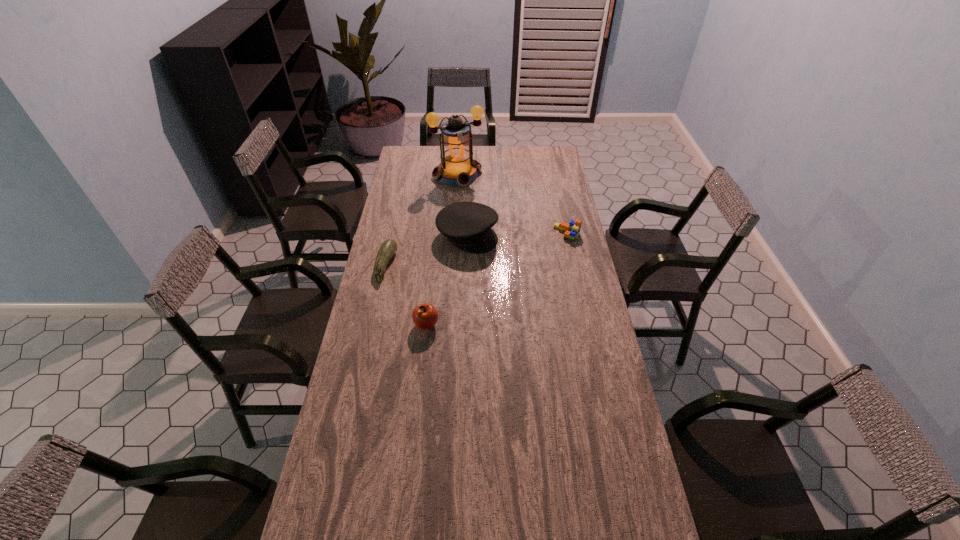
Locate an element on the screen. vacant area at the near edge is located at coordinates (419, 507).

I want to click on free space at the left edge of the desktop, so click(x=384, y=312).

Find the location of a particular element. The image size is (960, 540). free space at the right edge of the desktop is located at coordinates (603, 390).

Where is `free space that is in between the rightmost object and the farthest object`? The height and width of the screenshot is (540, 960). free space that is in between the rightmost object and the farthest object is located at coordinates (513, 204).

Locate an element on the screen. This screenshot has width=960, height=540. empty location between the apple and the zucchini is located at coordinates (406, 295).

The height and width of the screenshot is (540, 960). What are the coordinates of `empty location between the nearest object and the tallest object` in the screenshot? It's located at (442, 249).

The width and height of the screenshot is (960, 540). I want to click on free space between the apple and the rightmost object, so click(496, 279).

At what (x,y) coordinates should I click in order to perform the action: click on free space between the apple and the rightmost object. Please return your answer as a coordinate pair (x, y). Looking at the image, I should click on (496, 279).

I want to click on vacant space that's between the leftmost object and the lantern, so click(421, 220).

Where is `object that is the second nearest to the rightmost object`? This screenshot has width=960, height=540. object that is the second nearest to the rightmost object is located at coordinates (457, 168).